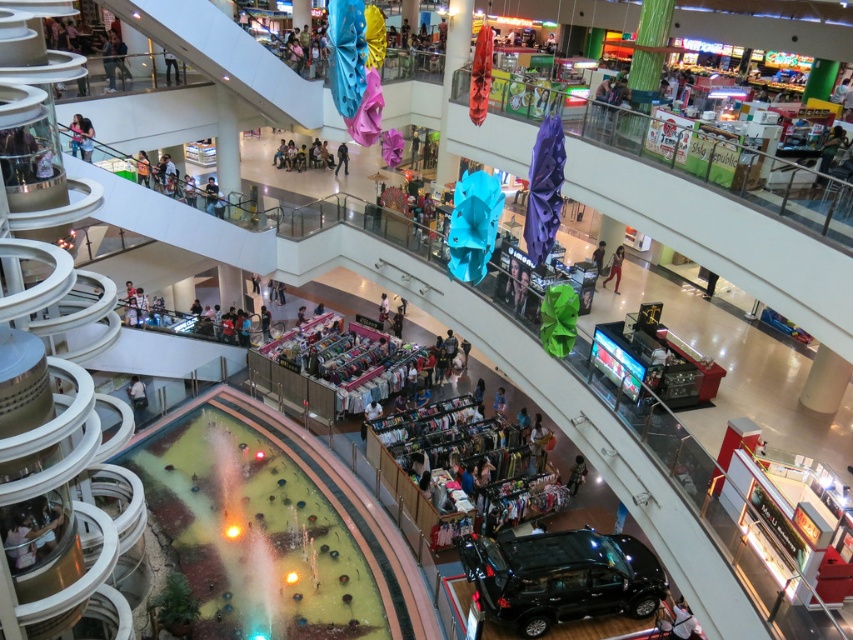
Question: Which point is farther to the camera?

Choices:
 (A) (239, 531)
 (B) (132, 376)
 (C) (344, 152)

Answer: (C)

Question: Which point is closer to the camera?

Choices:
 (A) white fabric person at lower left
 (B) green fabric umbrella at upper right
 (C) matte black jacket at center
 (D) black fabric pants at lower left

Answer: (B)

Question: Can you confirm if black glossy car at lower right is bigger than white fabric person at lower left?

Choices:
 (A) no
 (B) yes

Answer: (B)

Question: Is translucent glass fountain at center smaller than matte black jacket at center?

Choices:
 (A) no
 (B) yes

Answer: (A)

Question: Which object appears closest to the camera in this image?

Choices:
 (A) matte black jacket at center
 (B) black glossy car at lower right
 (C) matte black clothing at center
 (D) white fabric person at lower left

Answer: (B)

Question: Observing the image, what is the correct spatial positioning of skinny jeans at center in reference to black fabric pants at lower left?

Choices:
 (A) below
 (B) above

Answer: (A)